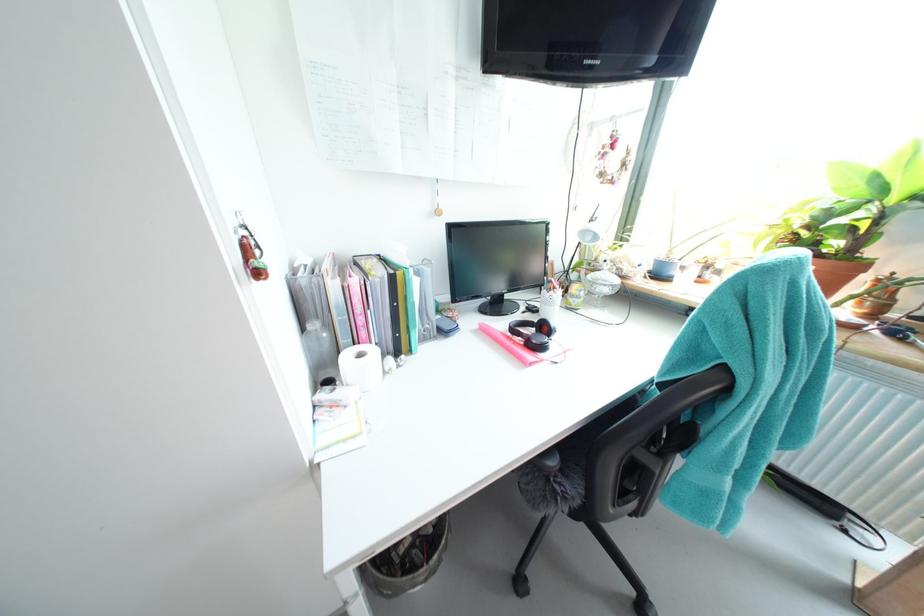
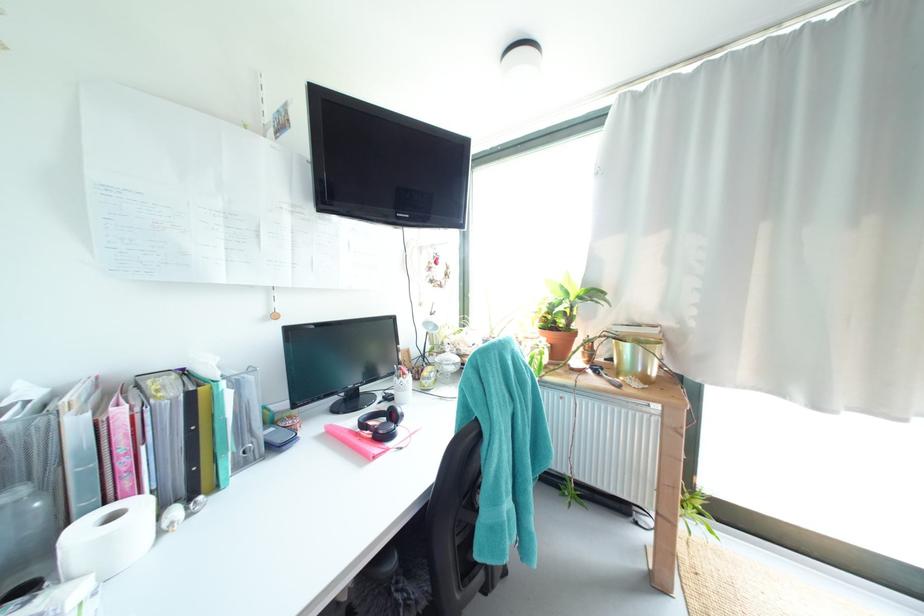
In the second image, find the point that corresponds to [371,336] in the first image.

(135, 485)